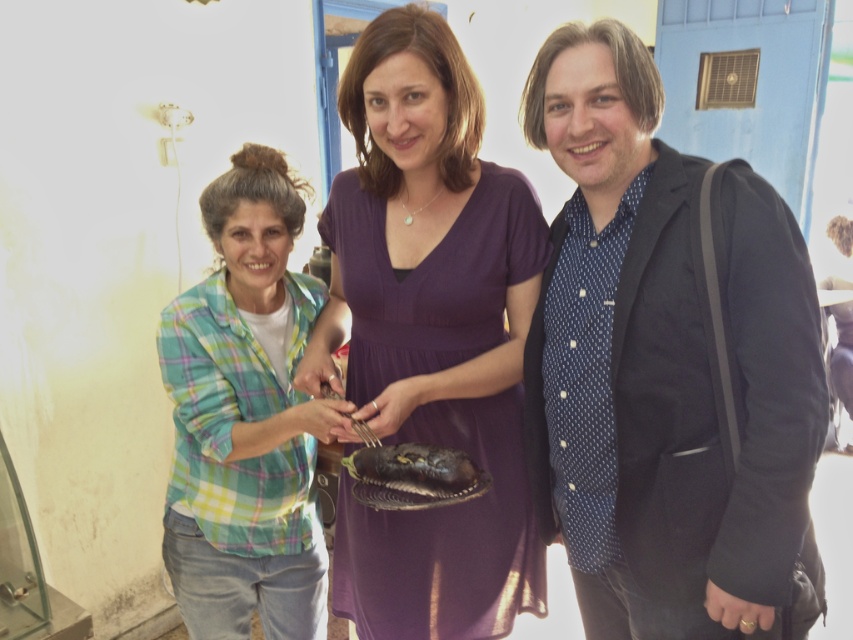
Measure the distance from purple satin dress at center to shiny silver plate at center.

purple satin dress at center is 8.94 inches away from shiny silver plate at center.

Which is behind, point (364, 192) or point (418, 508)?

Point (364, 192)

Image resolution: width=853 pixels, height=640 pixels. Identify the location of purple satin dress at center. (428, 336).

Between point (199, 364) and point (357, 460), which one is positioned behind?

The point (199, 364) is behind.

Is green plaid shirt at left positioned at the back of shiny silver plate at center?

That is True.

Locate an element on the screen. green plaid shirt at left is located at coordinates (245, 417).

The image size is (853, 640). I want to click on green plaid shirt at left, so click(245, 417).

Does purple satin dress at center appear on the right side of green plaid shirt at left?

Indeed, purple satin dress at center is positioned on the right side of green plaid shirt at left.

Does point (466, 163) lie behind point (254, 474)?

No, it is not.

You are a GUI agent. You are given a task and a screenshot of the screen. Output one action in this format:
    pyautogui.click(x=<x>, y=<y>)
    Task: Click on the purple satin dress at center
    The width and height of the screenshot is (853, 640).
    Given the screenshot: What is the action you would take?
    pyautogui.click(x=428, y=336)

At what (x,y) coordinates should I click in order to perform the action: click on purple satin dress at center. Please return your answer as a coordinate pair (x, y). Looking at the image, I should click on (428, 336).